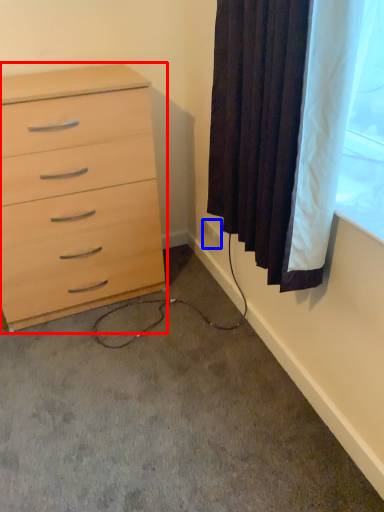
Question: Which object is further to the camera taking this photo, chest of drawers (highlighted by a red box) or electric outlet (highlighted by a blue box)?

Choices:
 (A) chest of drawers
 (B) electric outlet

Answer: (B)